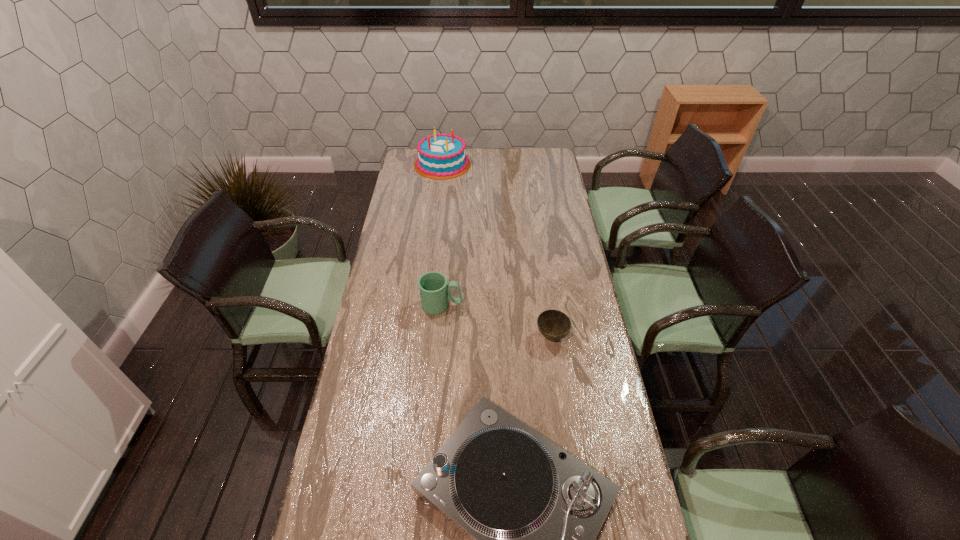
Identify the location of the tallest object. The image size is (960, 540). (442, 156).

Find the location of `the farthest object`. the farthest object is located at coordinates (442, 156).

This screenshot has height=540, width=960. I want to click on the second farthest object, so click(434, 292).

Where is `the second tallest object`? the second tallest object is located at coordinates (434, 292).

Where is `bowl`? bowl is located at coordinates (554, 325).

You are a GUI agent. You are given a task and a screenshot of the screen. Output one action in this format:
    pyautogui.click(x=<x>, y=<y>)
    Task: Click on the shortest object
    This screenshot has width=960, height=540.
    Given the screenshot: What is the action you would take?
    pyautogui.click(x=554, y=325)

I want to click on free space located 0.250m on the right of the tallest object, so click(518, 164).

You are a GUI agent. You are given a task and a screenshot of the screen. Output one action in this format:
    pyautogui.click(x=<x>, y=<y>)
    Task: Click on the vacant point located on the side of the second tallest object with the handle
    
    Given the screenshot: What is the action you would take?
    pyautogui.click(x=525, y=306)

This screenshot has width=960, height=540. I want to click on free space located 0.230m on the back of the second nearest object, so click(543, 279).

The image size is (960, 540). I want to click on object at the far edge, so click(442, 156).